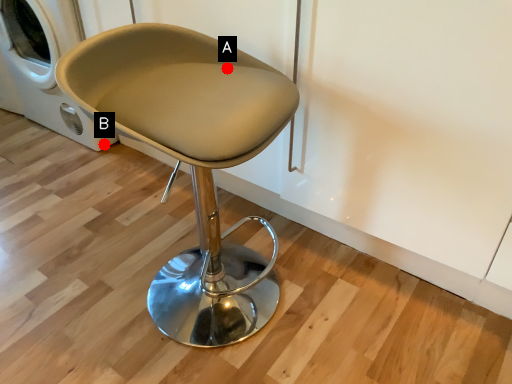
Question: Two points are circled on the image, labeled by A and B beside each circle. Which point is closer to the camera?

Choices:
 (A) A is closer
 (B) B is closer

Answer: (A)